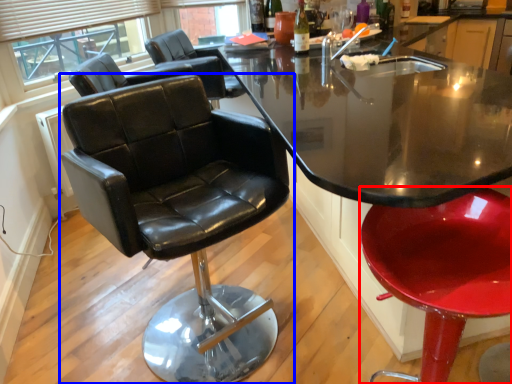
Question: Which object appears farthest to the camera in this image, chair (highlighted by a red box) or chair (highlighted by a blue box)?

Choices:
 (A) chair
 (B) chair

Answer: (B)